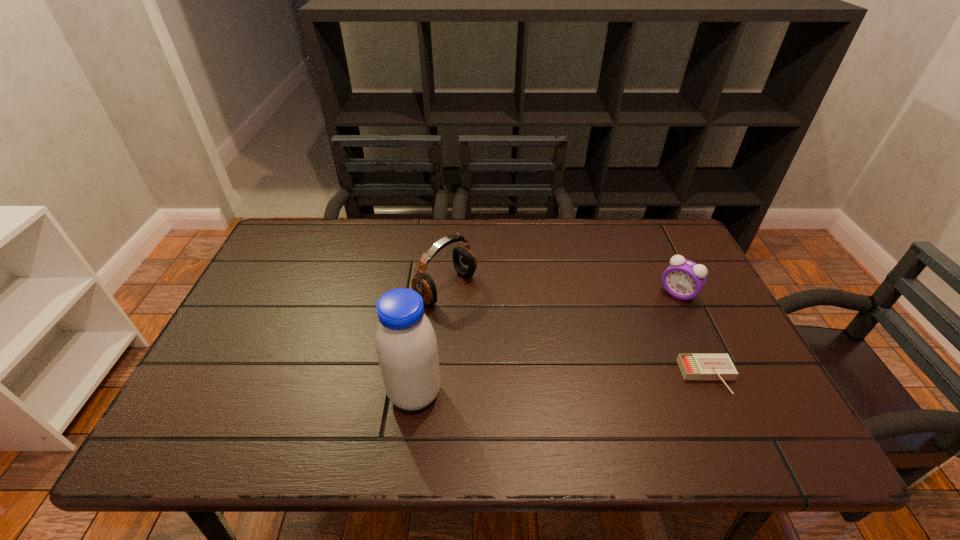
The width and height of the screenshot is (960, 540). Find the location of `soya milk`. soya milk is located at coordinates (x=406, y=345).

This screenshot has height=540, width=960. In order to click on the shortest object in this screenshot , I will do [692, 366].

At what (x,y) coordinates should I click in order to perform the action: click on headset. Please return your answer as a coordinate pair (x, y). Image resolution: width=960 pixels, height=540 pixels. Looking at the image, I should click on (465, 263).

Where is `the second shortest object`? the second shortest object is located at coordinates (683, 279).

Locate an element on the screen. Image resolution: width=960 pixels, height=540 pixels. vacant area located on the right of the soya milk is located at coordinates (520, 394).

I want to click on vacant space located 0.120m on the ear cups of the headset, so (502, 325).

You are a GUI agent. You are given a task and a screenshot of the screen. Output one action in this format:
    pyautogui.click(x=<x>, y=<y>)
    Task: Click on the vacant region located 0.080m on the ear cups of the headset
    
    Given the screenshot: What is the action you would take?
    pyautogui.click(x=491, y=318)

Find the location of a particular element. vacant space located 0.070m on the ear cups of the headset is located at coordinates (488, 315).

Image resolution: width=960 pixels, height=540 pixels. What are the coordinates of `vacant area situated on the face of the second shortest object` in the screenshot? It's located at (622, 361).

Locate an element on the screen. vacant area situated on the face of the second shortest object is located at coordinates (628, 354).